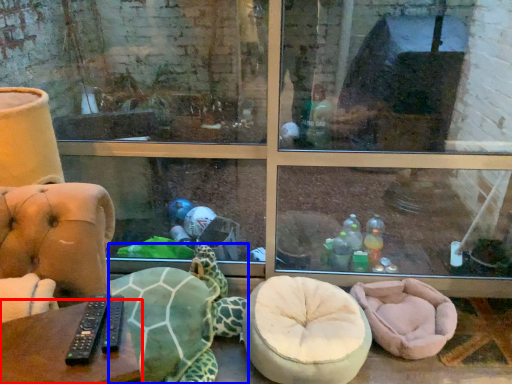
Question: Among these objects, which one is farthest to the camera, table (highlighted by a red box) or tortoise (highlighted by a blue box)?

Choices:
 (A) table
 (B) tortoise

Answer: (B)